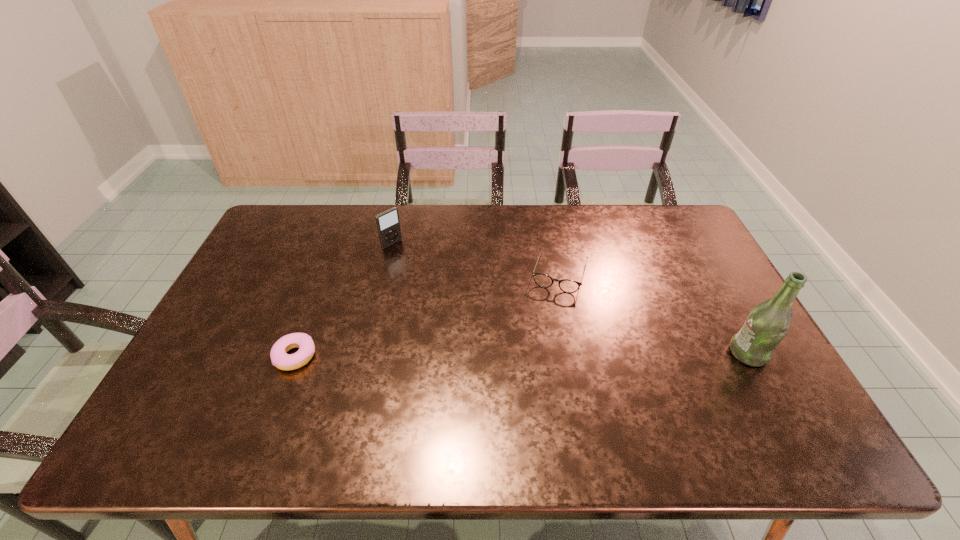
This screenshot has width=960, height=540. What are the coordinates of `free spot at the near left corner of the desktop` in the screenshot? It's located at (180, 384).

At what (x,y) coordinates should I click in order to perform the action: click on vacant space at the far right corner. Please return your answer as a coordinate pair (x, y). The height and width of the screenshot is (540, 960). Looking at the image, I should click on (659, 215).

Image resolution: width=960 pixels, height=540 pixels. Find the location of `vacant region at the near right corner of the desktop`. vacant region at the near right corner of the desktop is located at coordinates (776, 402).

In order to click on free space between the rightmost object and the second tallest object in this screenshot , I will do `click(570, 299)`.

This screenshot has width=960, height=540. What are the coordinates of `empty space between the doughnut and the second object from right to left` in the screenshot? It's located at pyautogui.click(x=428, y=314).

Where is `unoccupied area between the second shortest object and the doughnut`? unoccupied area between the second shortest object and the doughnut is located at coordinates (428, 314).

Locate an element on the screen. The image size is (960, 540). vacant area that lies between the beer bottle and the third shortest object is located at coordinates (570, 299).

Where is `vacant space that's between the second farthest object and the leftmost object`? vacant space that's between the second farthest object and the leftmost object is located at coordinates (428, 314).

What are the coordinates of `vacant region between the tallest object and the leftmost object` in the screenshot? It's located at (522, 355).

Locate an element on the screen. This screenshot has width=960, height=540. empty space that is in between the iPod and the leftmost object is located at coordinates (344, 300).